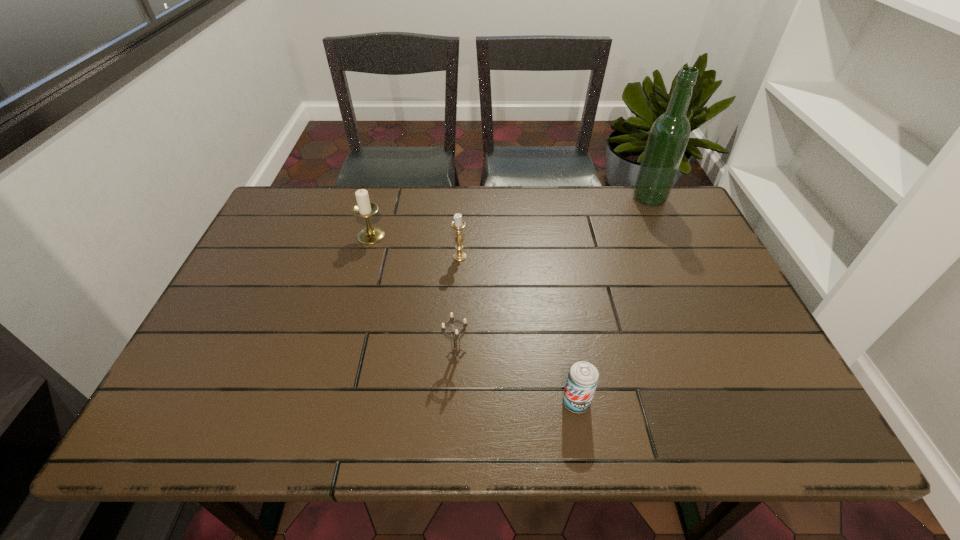
Locate an element on the screen. The width and height of the screenshot is (960, 540). the rightmost object is located at coordinates (669, 134).

Locate an element on the screen. liquor is located at coordinates (669, 134).

This screenshot has width=960, height=540. I want to click on the leftmost object, so click(364, 208).

Locate an element on the screen. Image resolution: width=960 pixels, height=540 pixels. the leftmost candle holder is located at coordinates (364, 208).

Find the location of a particular element. This screenshot has width=960, height=540. the third farthest object is located at coordinates (458, 224).

Identify the location of the nearest candle holder. (456, 350).

At what (x,y) coordinates should I click in order to perform the action: click on the shortest candle holder. Please return your answer as a coordinate pair (x, y). The height and width of the screenshot is (540, 960). Looking at the image, I should click on tap(456, 350).

Identify the location of beer can. Image resolution: width=960 pixels, height=540 pixels. (583, 377).

Locate an element on the screen. Image resolution: width=960 pixels, height=540 pixels. the second object from right to left is located at coordinates (583, 377).

Find the location of a particular element. This screenshot has width=960, height=540. free space located on the front of the tallest object is located at coordinates (668, 239).